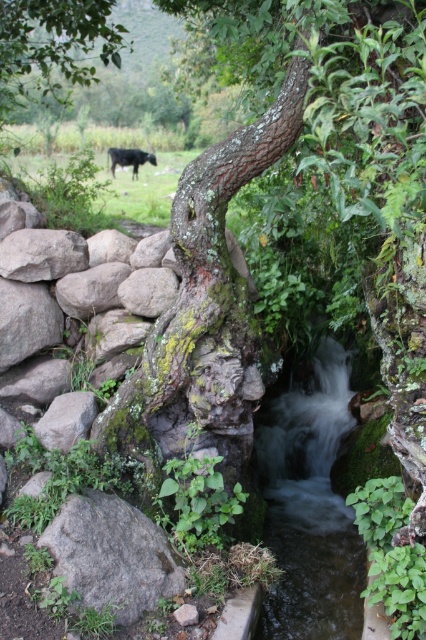
Question: Which point is farther to the camera?

Choices:
 (A) (173, 230)
 (B) (294, 568)
 (C) (161, 538)

Answer: (B)

Question: Observing the image, what is the correct spatial positioning of clear water stream at center in reference to gray rough rock at lower left?

Choices:
 (A) left
 (B) right

Answer: (B)

Question: Does green mossy rock at lower left appear over black glossy cow at center?

Choices:
 (A) yes
 (B) no

Answer: (B)

Question: Among these objects, which one is farthest from the camera?

Choices:
 (A) lichen-covered bark tree trunk at center
 (B) black glossy cow at center
 (C) green mossy rock at lower left
 (D) clear water stream at center

Answer: (B)

Question: Which point is farther to the camera?

Choices:
 (A) (149, 525)
 (B) (207, 214)
 (C) (77, 403)

Answer: (C)

Question: From the image, what is the correct spatial relationship of clear water stream at center in relation to green mossy rock at lower left?

Choices:
 (A) left
 (B) right

Answer: (B)